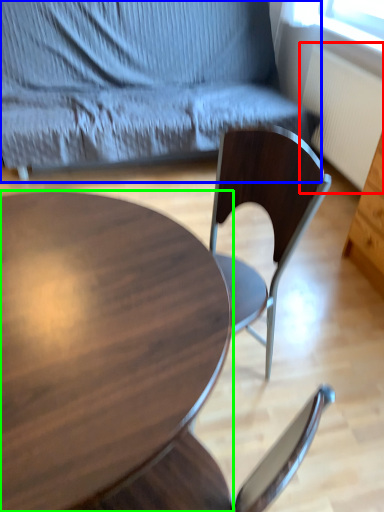
Question: Which object is positioned closest to radiator (highlighted by a red box)? Select from chair (highlighted by a blue box) and coffee table (highlighted by a green box).

Choices:
 (A) chair
 (B) coffee table

Answer: (A)